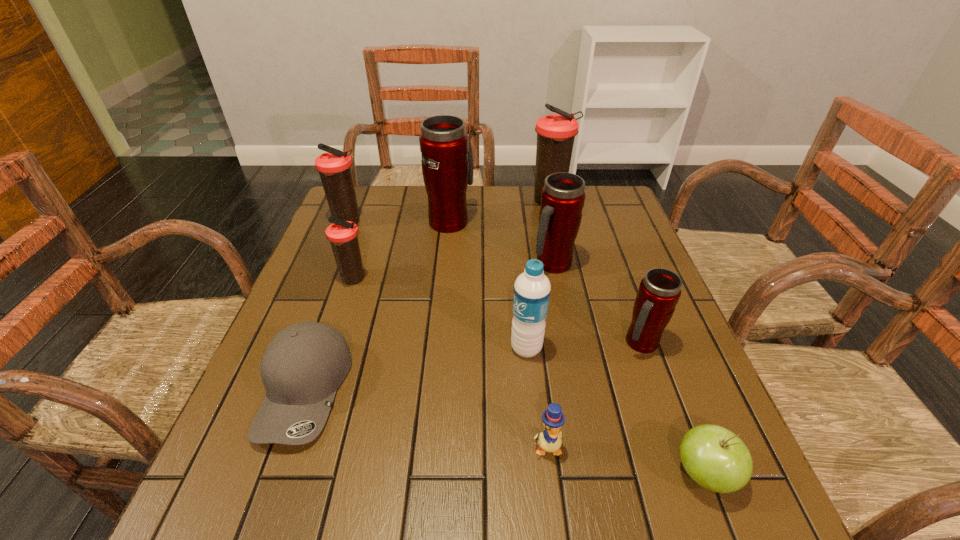
In order to click on object at the far right corner in this screenshot , I will do `click(556, 133)`.

Where is `object positioned at the near right corner`? This screenshot has height=540, width=960. object positioned at the near right corner is located at coordinates (714, 457).

Identify the location of blank area at the near edge. (476, 523).

Identify the location of free space at the left edge of the desktop. The image size is (960, 540). (249, 441).

You are a GUI agent. You are given a task and a screenshot of the screen. Output one action in this format:
    pyautogui.click(x=<x>, y=<y>)
    Task: Click on the vacant region at the right edge of the desktop
    This screenshot has height=540, width=960.
    Given the screenshot: What is the action you would take?
    pyautogui.click(x=656, y=370)

This screenshot has height=540, width=960. In the image, there is a desktop. In order to click on vacant space at the far right corner in this screenshot , I will do `click(615, 219)`.

The image size is (960, 540). Find the location of `vacant space at the near right corner of the desktop`. vacant space at the near right corner of the desktop is located at coordinates (693, 499).

Identify the location of vacant space that is in between the water bottle and the leftmost red thermos bottle. (489, 285).

Where is `blank region between the rightmost red thermos bottle and the gray baseball cap`? The height and width of the screenshot is (540, 960). blank region between the rightmost red thermos bottle and the gray baseball cap is located at coordinates (473, 367).

Locate an element on the screen. Image resolution: width=960 pixels, height=540 pixels. unoccupied area between the water bottle and the gray baseball cap is located at coordinates (416, 369).